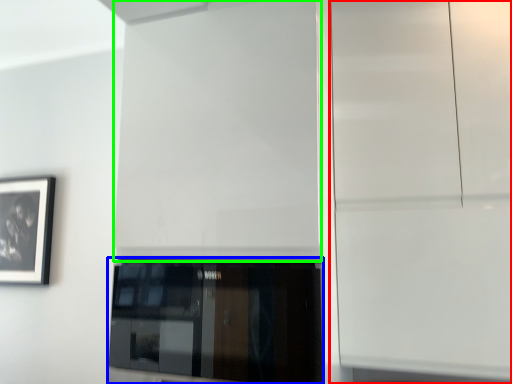
Question: Estimate the real-world distances between objects in this image. Which object is farther from glass door (highlighted by a red box), window (highlighted by a blue box) or door (highlighted by a green box)?

Choices:
 (A) window
 (B) door

Answer: (A)